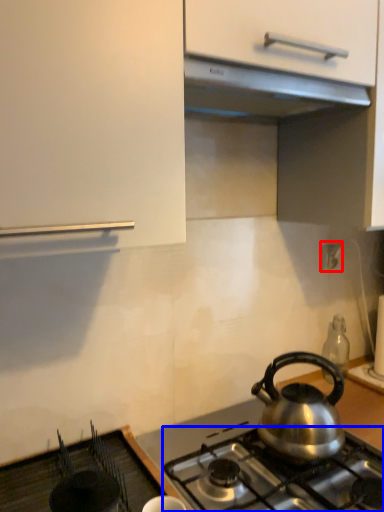
Question: Which of the following is the farthest to the observer, electric outlet (highlighted by a red box) or gas stove (highlighted by a blue box)?

Choices:
 (A) electric outlet
 (B) gas stove

Answer: (A)